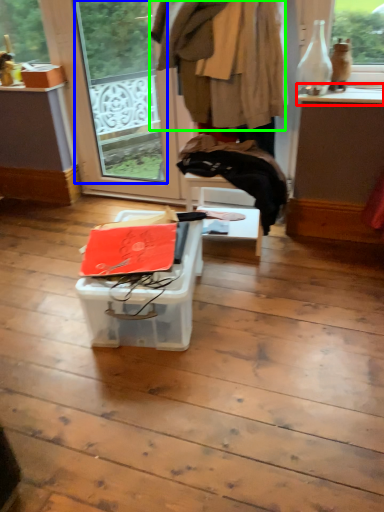
Question: Which object is positioned closest to window sill (highlighted by a red box)? Select from window screen (highlighted by a blue box) and clothing (highlighted by a green box).

Choices:
 (A) window screen
 (B) clothing

Answer: (B)